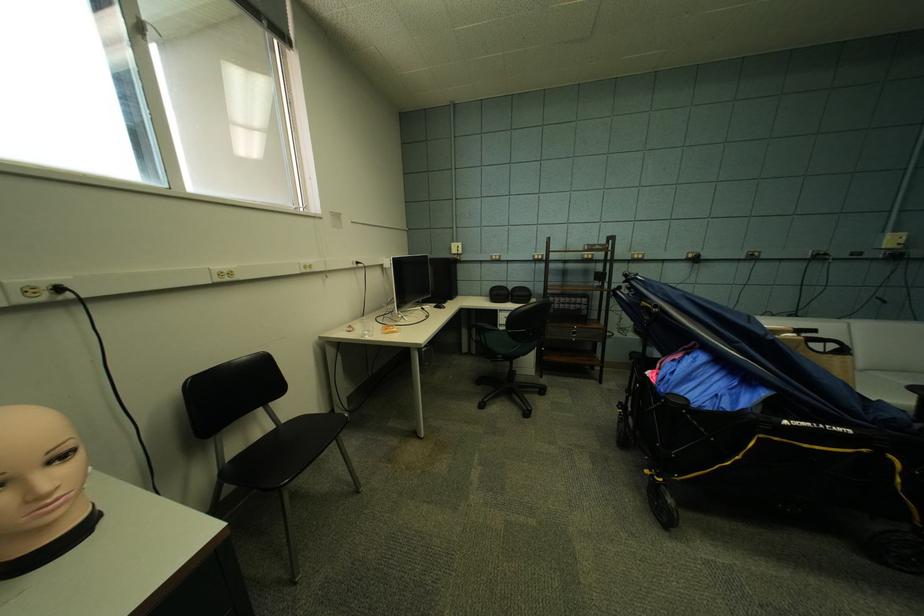
Locate an element on the screen. The height and width of the screenshot is (616, 924). sofa sitting surface is located at coordinates (889, 346).